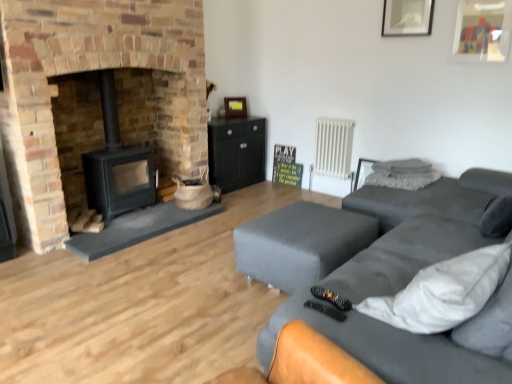
Question: Is point (160, 4) positioned closer to the camera than point (245, 178)?

Choices:
 (A) closer
 (B) farther

Answer: (A)

Question: From the image's perspective, is brick fireplace at left positioned above or below black matte cabinet at center?

Choices:
 (A) below
 (B) above

Answer: (B)

Question: Which is nearer to the white textured pillow at upper right, the 2th pillow in the bottom-to-top sequence?

Choices:
 (A) wooden picture frame at upper center, the first picture frame positioned from the back
 (B) black matte wood burning stove at left
 (C) white glossy picture frame at upper right, which ranks as the 2th picture frame in left-to-right order
 (D) brick fireplace at left
 (E) white metallic radiator at upper right

Answer: (E)

Question: Which of these objects is positioned closest to the wooden picture frame at upper center, positioned as the 1th picture frame in bottom-to-top order?

Choices:
 (A) black matte cabinet at center
 (B) white textured pillow at upper right, which ranks as the second pillow in top-to-bottom order
 (C) brick fireplace at left
 (D) white glossy picture frame at upper right, which appears as the second picture frame when ordered from the bottom
 (E) matte gray ottoman at lower right

Answer: (A)